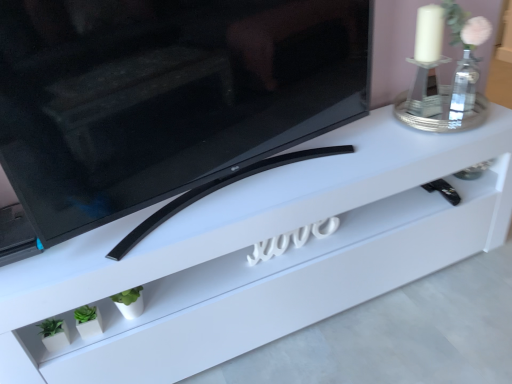
Question: Are white glass candle holder at upper right and white glossy tv stand at center making contact?

Choices:
 (A) no
 (B) yes

Answer: (A)

Question: Would you say white glass candle holder at upper right is a long distance from white glossy tv stand at center?

Choices:
 (A) no
 (B) yes

Answer: (A)

Question: Is white glass candle holder at upper right positioned before white glossy tv stand at center?

Choices:
 (A) yes
 (B) no

Answer: (B)

Question: From the image's perspective, is white glass candle holder at upper right on top of white glossy tv stand at center?

Choices:
 (A) no
 (B) yes

Answer: (B)

Question: Is white glass candle holder at upper right thinner than white glossy tv stand at center?

Choices:
 (A) no
 (B) yes

Answer: (B)

Question: From the image's perspective, is white glass candle holder at upper right below white glossy tv stand at center?

Choices:
 (A) no
 (B) yes

Answer: (A)

Question: Considering the relative positions of black glossy tv at center and white glass candle holder at upper right in the image provided, is black glossy tv at center to the left of white glass candle holder at upper right from the viewer's perspective?

Choices:
 (A) yes
 (B) no

Answer: (A)

Question: From the image's perspective, would you say black glossy tv at center is positioned over white glass candle holder at upper right?

Choices:
 (A) no
 (B) yes

Answer: (A)

Question: Is black glossy tv at center surrounding white glass candle holder at upper right?

Choices:
 (A) yes
 (B) no

Answer: (B)

Question: Does black glossy tv at center have a greater width compared to white glass candle holder at upper right?

Choices:
 (A) no
 (B) yes

Answer: (B)

Question: From a real-world perspective, is black glossy tv at center physically above white glass candle holder at upper right?

Choices:
 (A) no
 (B) yes

Answer: (B)

Question: Can you confirm if black glossy tv at center is bigger than white glass candle holder at upper right?

Choices:
 (A) yes
 (B) no

Answer: (A)

Question: Is white matte planter at lower left shorter than black glossy tv at center?

Choices:
 (A) yes
 (B) no

Answer: (A)